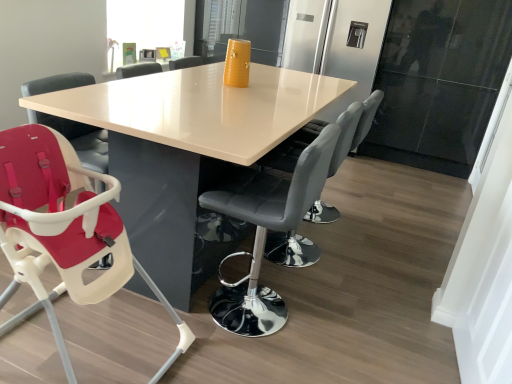
Image resolution: width=512 pixels, height=384 pixels. In order to click on free point to the right of matte black chair at center, which is counted as the 1th chair, starting from the right in this screenshot , I will do `click(359, 259)`.